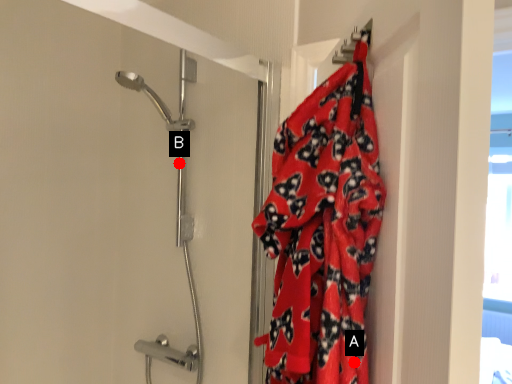
Question: Two points are circled on the image, labeled by A and B beside each circle. Among these points, which one is farthest from the camera?

Choices:
 (A) A is further
 (B) B is further

Answer: (B)